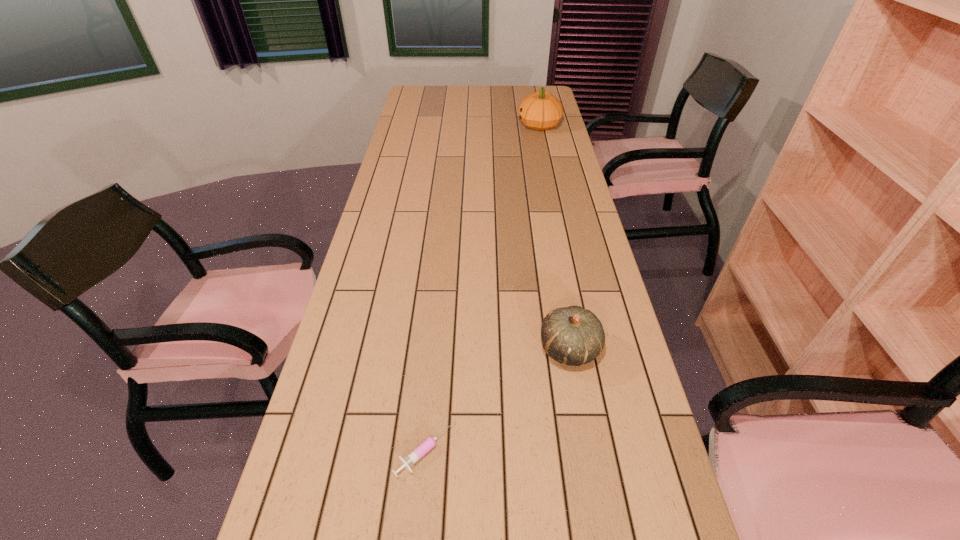
You are a GUI agent. You are given a task and a screenshot of the screen. Output one action in this format:
    pyautogui.click(x=<x>, y=<y>)
    Task: Click on the tallest object
    This screenshot has width=960, height=540.
    Given the screenshot: What is the action you would take?
    pyautogui.click(x=540, y=111)

The image size is (960, 540). I want to click on the farthest object, so coord(540,111).

You are a GUI agent. You are given a task and a screenshot of the screen. Output one action in this format:
    pyautogui.click(x=<x>, y=<y>)
    Task: Click on the shorter gourd
    The image size is (960, 540).
    Given the screenshot: What is the action you would take?
    pyautogui.click(x=574, y=336)

This screenshot has width=960, height=540. In order to click on the nearer gourd in this screenshot , I will do `click(574, 336)`.

The height and width of the screenshot is (540, 960). What are the coordinates of `syringe` in the screenshot? It's located at (421, 450).

The width and height of the screenshot is (960, 540). What are the coordinates of `the leftmost object` in the screenshot? It's located at (421, 450).

This screenshot has height=540, width=960. Find the location of `vacant position located 0.380m on the side of the tallest object with the carved face`. vacant position located 0.380m on the side of the tallest object with the carved face is located at coordinates (431, 125).

This screenshot has height=540, width=960. In order to click on vacant space located 0.150m on the side of the tallest object with the carved face in this screenshot , I will do `click(483, 125)`.

The width and height of the screenshot is (960, 540). I want to click on free space located 0.260m on the side of the tallest object with the carved face, so pyautogui.click(x=458, y=125).

Image resolution: width=960 pixels, height=540 pixels. In order to click on free region located 0.290m on the back of the shorter gourd in this screenshot , I will do `click(552, 251)`.